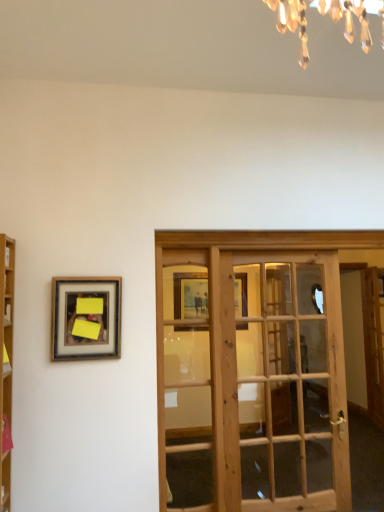
Locate an element on the screen. wooden french door at center is located at coordinates (252, 371).

Measure the distance between point (13, 279) and camera.

They are 6.77 feet apart.

The height and width of the screenshot is (512, 384). Identify the location of wooden framed picture at left. (86, 318).

From the picture: From a real-world perspective, is wooden bookshelf at left beneath wooden french door at center?

No, from a real-world perspective, wooden bookshelf at left is not below wooden french door at center.

Is point (2, 440) behind point (219, 449)?

No, (2, 440) is in front of (219, 449).

Considering their positions, is wooden bookshelf at left located in front of or behind wooden french door at center?

Visually, wooden bookshelf at left is located in front of wooden french door at center.

Between wooden bookshelf at left and wooden french door at center, which one has more height?

Standing taller between the two is wooden french door at center.

Based on the photo, can you confirm if wooden framed picture at left is wider than wooden bookshelf at left?

No, wooden framed picture at left is not wider than wooden bookshelf at left.

From a real-world perspective, is wooden framed picture at left on wooden bookshelf at left?

Indeed, from a real-world perspective, wooden framed picture at left stands above wooden bookshelf at left.

Looking at this image, from the image's perspective, which is below, wooden framed picture at left or wooden bookshelf at left?

wooden bookshelf at left is shown below in the image.

Is wooden bookshelf at left to the left of wooden framed picture at left from the viewer's perspective?

Yes, wooden bookshelf at left is to the left of wooden framed picture at left.

Is wooden bookshelf at left closer to the viewer compared to wooden framed picture at left?

Yes, the depth of wooden bookshelf at left is less than that of wooden framed picture at left.

Which of these two, wooden bookshelf at left or wooden framed picture at left, is wider?

With larger width is wooden bookshelf at left.

Is wooden bookshelf at left located outside wooden framed picture at left?

Yes, wooden bookshelf at left is not within wooden framed picture at left.

From the image's perspective, who appears lower, wooden framed picture at left or wooden french door at center?

wooden french door at center.

Measure the distance between wooden framed picture at left and wooden french door at center.

wooden framed picture at left is 24.63 inches away from wooden french door at center.

From a real-world perspective, which is physically above, wooden framed picture at left or wooden french door at center?

wooden framed picture at left, from a real-world perspective.

How different are the orientations of wooden framed picture at left and wooden french door at center in degrees?

The facing directions of wooden framed picture at left and wooden french door at center are 2.5 degrees apart.

In the scene shown: Considering the relative positions of wooden french door at center and wooden framed picture at left in the image provided, is wooden french door at center to the left of wooden framed picture at left from the viewer's perspective?

No.

From a real-world perspective, is wooden french door at center positioned under wooden framed picture at left based on gravity?

Yes, from a real-world perspective, wooden french door at center is beneath wooden framed picture at left.

Is wooden french door at center positioned beyond the bounds of wooden framed picture at left?

That's correct, wooden french door at center is outside of wooden framed picture at left.

Can you confirm if wooden french door at center is wider than wooden framed picture at left?

Yes.

Which point is more forward, (193, 329) or (12, 355)?

Point (12, 355)

The width and height of the screenshot is (384, 512). What are the coordinates of `door that is under the wooden bookshelf at left (from a real-world perspective)` in the screenshot? It's located at (252, 371).

Is wooden french door at center at the right side of wooden bookshelf at left?

Yes, wooden french door at center is to the right of wooden bookshelf at left.

Is wooden bookshelf at left completely or partially inside wooden french door at center?

Definitely not — wooden bookshelf at left is not inside wooden french door at center.

You are a GUI agent. You are given a task and a screenshot of the screen. Output one action in this format:
    pyautogui.click(x=<x>, y=<y>)
    Task: Click on the cabinetry in front of the wooden french door at center
    
    Given the screenshot: What is the action you would take?
    pyautogui.click(x=6, y=364)

Identify the location of picture frame lying behind the wooden bookshelf at left. (86, 318).

From the image, which object appears to be farther from wooden framed picture at left, wooden french door at center or wooden bookshelf at left?

wooden french door at center lies further to wooden framed picture at left than the other object.

Which object lies nearer to the anchor point wooden bookshelf at left, wooden framed picture at left or wooden french door at center?

wooden framed picture at left lies closer to wooden bookshelf at left than the other object.

In the scene shown: When comparing their distances from wooden framed picture at left, does wooden bookshelf at left or wooden french door at center seem closer?

wooden bookshelf at left lies closer to wooden framed picture at left than the other object.

Looking at the image, which one is located closer to wooden french door at center, wooden bookshelf at left or wooden framed picture at left?

wooden framed picture at left.

Which object lies nearer to the anchor point wooden bookshelf at left, wooden french door at center or wooden framed picture at left?

wooden framed picture at left lies closer to wooden bookshelf at left than the other object.

When comparing their distances from wooden french door at center, does wooden framed picture at left or wooden bookshelf at left seem further?

Among the two, wooden bookshelf at left is located further to wooden french door at center.

The height and width of the screenshot is (512, 384). In order to click on picture frame between wooden bookshelf at left and wooden french door at center in this screenshot , I will do `click(86, 318)`.